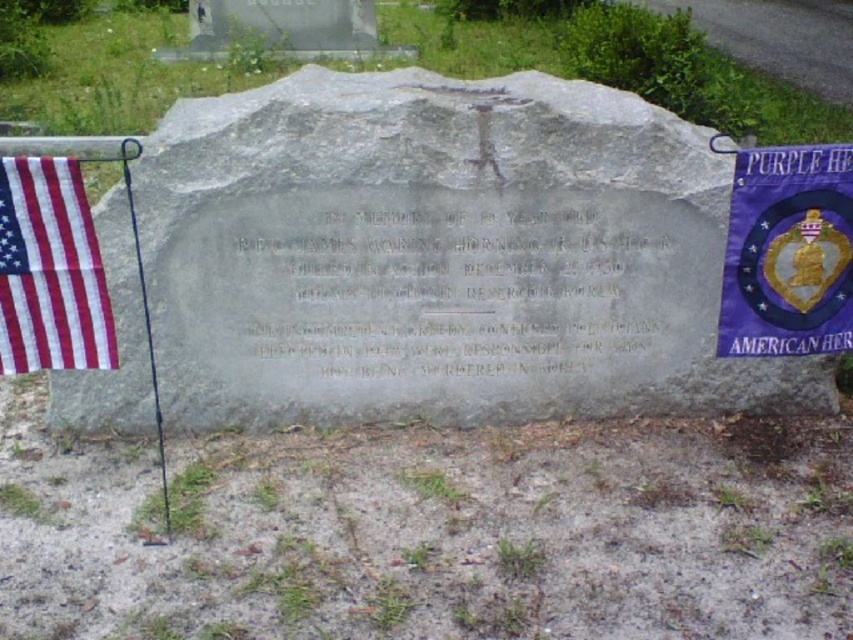
Does purple fabric banner at upper right appear on the left side of american fabric flag at left?

No, purple fabric banner at upper right is not to the left of american fabric flag at left.

Between point (775, 339) and point (42, 214), which one is positioned behind?

Positioned behind is point (775, 339).

Where is `purple fabric banner at upper right`? The image size is (853, 640). purple fabric banner at upper right is located at coordinates (788, 252).

Is gray stone at center shorter than american fabric flag at left?

No, gray stone at center is not shorter than american fabric flag at left.

From the picture: Which is below, gray stone at center or american fabric flag at left?

american fabric flag at left is lower down.

Describe the element at coordinates (440, 256) in the screenshot. I see `gray stone at center` at that location.

Locate an element on the screen. Image resolution: width=853 pixels, height=640 pixels. gray stone at center is located at coordinates (440, 256).

Does point (540, 323) come farther from viewer compared to point (849, 308)?

Yes, it is behind point (849, 308).

Is gray stone at center further to the viewer compared to purple fabric banner at upper right?

Yes, it is behind purple fabric banner at upper right.

Is point (381, 244) positioned after point (728, 326)?

No.

The height and width of the screenshot is (640, 853). What are the coordinates of `gray stone at center` in the screenshot? It's located at (440, 256).